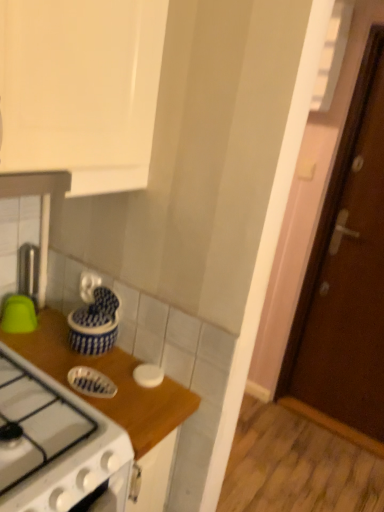
This screenshot has width=384, height=512. I want to click on vacant area that lies between white matte lid at center, which is counted as the first kitchen appliance, starting from the right, and green matte bowl at left, placed as the 1th kitchen appliance when sorted from left to right, so click(87, 352).